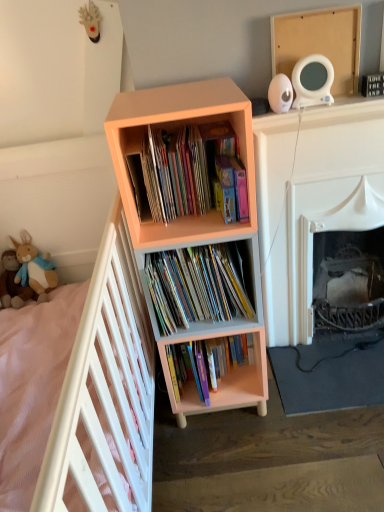
The width and height of the screenshot is (384, 512). What are the coordinates of `unoccupied area in front of peach matte bookcase at center` in the screenshot? It's located at (231, 463).